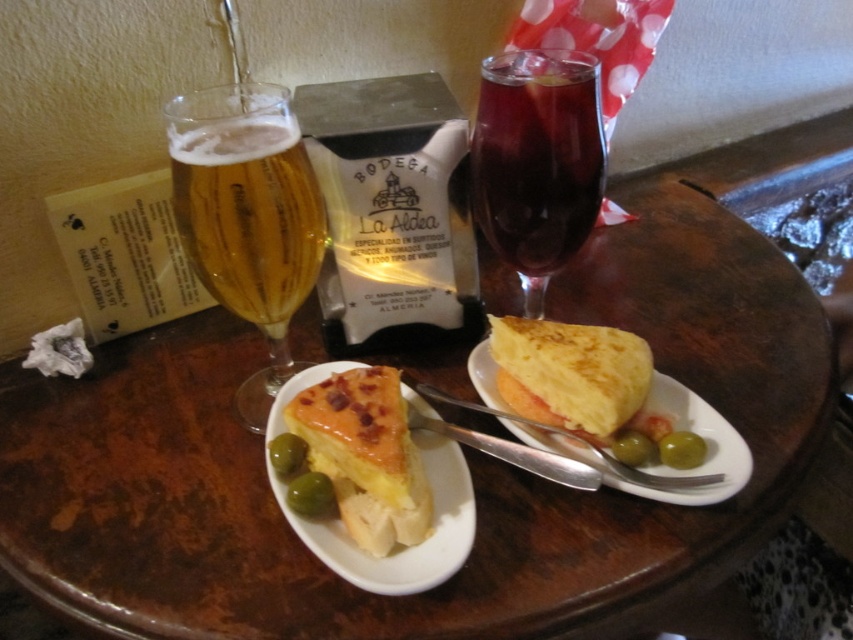
You are sitting at the wooden table and want to reach both the point at coordinates (561, 236) and the point at coordinates (320, 516). Which point will you reach first?

You will reach point (561, 236) first because it is closer to you than point (320, 516), which is further away.

You are standing 20 inches away from the table. Is the point at coordinate point (311, 284) on the table closer to you than the edge of the table?

The distance of point (311, 284) from viewer is 22.06 inches. Since you are standing 20 inches away from the table, the point is farther away than your current position, so it is not closer to you than the edge of the table.

You are a bartender preparing a drink and need to place both the golden glass beer at left and the green glossy olive at center on a shelf. The shelf has a width of 10 cm. Can both items fit side by side on the shelf?

The golden glass beer at left is wider than the green glossy olive at center. However, since the shelf is only 10 cm wide, it is uncertain if both can fit without overlapping unless the combined width of both items is less than or equal to 10 cm. The exact dimensions of each item are not provided, so we cannot confirm for sure.